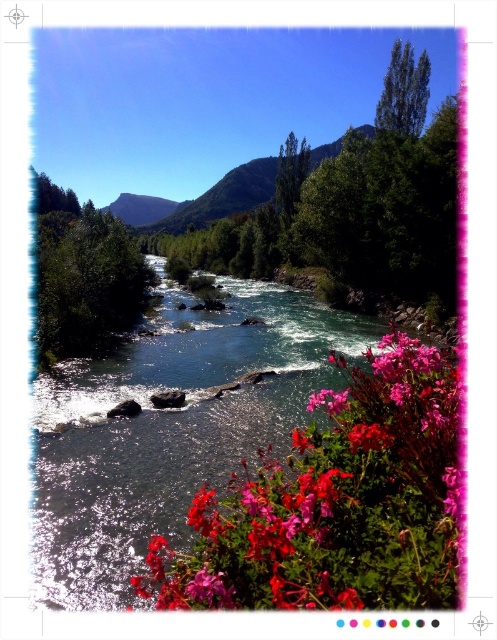
You are standing at the viewpoint of the image and want to take a photo of both point (378, 493) and point (239, 195). Which point will appear larger in your camera frame?

Point (378, 493) will appear larger in the camera frame because it is closer to the camera than point (239, 195).

You are standing in the valley and want to pick some flowers. You see the vivid pink petals at lower right and the green forested mountain at upper center. Which object is nearer to you?

The vivid pink petals at lower right are closer to the viewer than the green forested mountain at upper center.